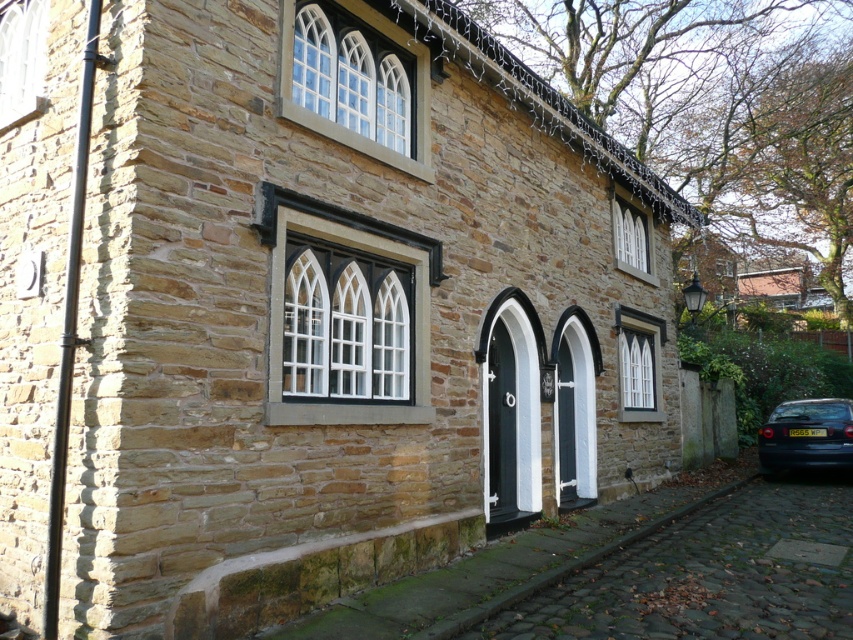
How much distance is there between clear glass window at upper left and white glass window at center?

A distance of 29.00 feet exists between clear glass window at upper left and white glass window at center.

Does point (32, 96) come farther from viewer compared to point (637, 356)?

No.

Measure the distance between clear glass window at upper left and camera.

clear glass window at upper left is 4.89 meters from camera.

Identify the location of clear glass window at upper left. This screenshot has width=853, height=640. (21, 60).

Who is taller, dark blue metallic car at lower right or clear glass window at upper left?

dark blue metallic car at lower right

Locate an element on the screen. The image size is (853, 640). dark blue metallic car at lower right is located at coordinates (805, 435).

At what (x,y) coordinates should I click in order to perform the action: click on dark blue metallic car at lower right. Please return your answer as a coordinate pair (x, y). The image size is (853, 640). Looking at the image, I should click on (805, 435).

The width and height of the screenshot is (853, 640). What do you see at coordinates (805, 435) in the screenshot? I see `dark blue metallic car at lower right` at bounding box center [805, 435].

Where is `dark blue metallic car at lower right`? This screenshot has width=853, height=640. dark blue metallic car at lower right is located at coordinates (805, 435).

Where is `dark blue metallic car at lower right`? dark blue metallic car at lower right is located at coordinates (805, 435).